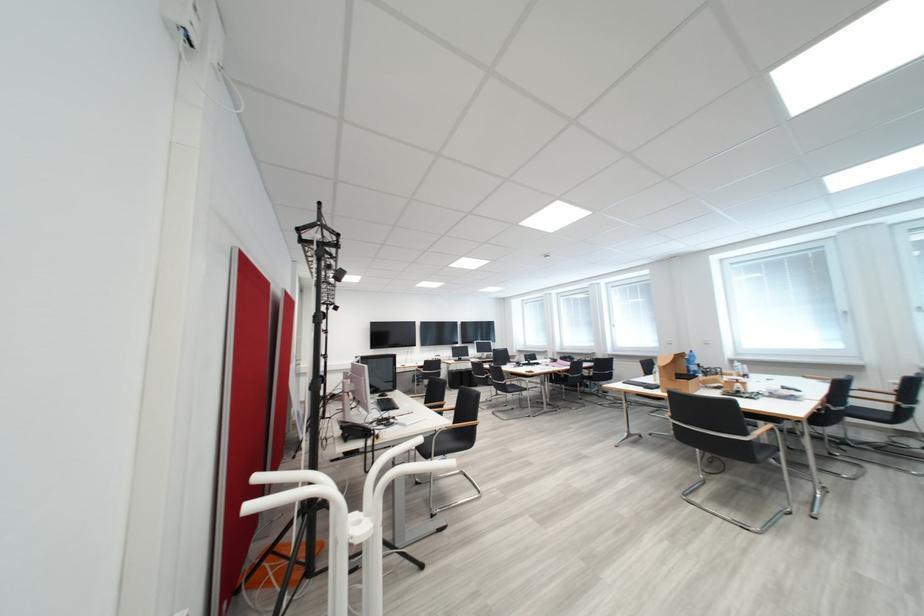
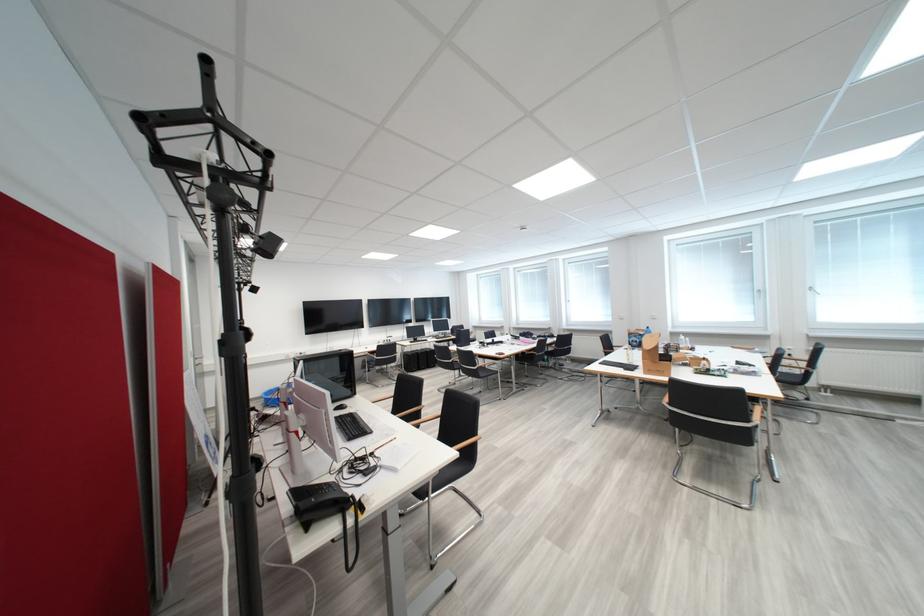
Question: The camera is either moving clockwise (left) or counter-clockwise (right) around the object. The first image is from the beginning of the video and the second image is from the end. Is the camera moving left or right when shooting the video?

Choices:
 (A) Left
 (B) Right

Answer: (A)